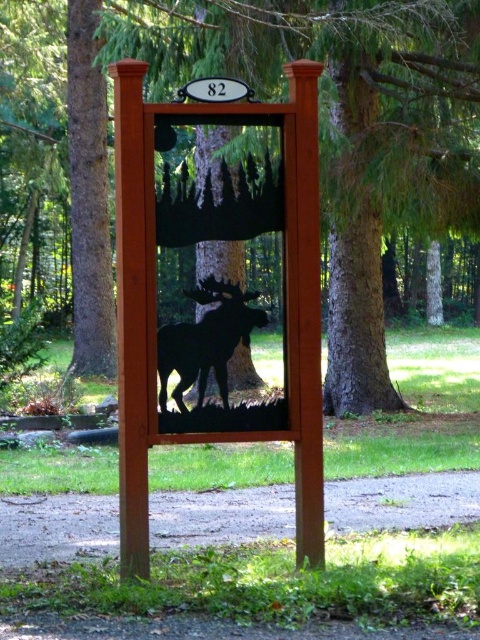
You are a hiker who just arrived at the signpost and wants to take a photo of the matte wood sign at center and the black matte moose at center. Since you want both objects to be clearly visible in your photo, which one should you focus on first?

The matte wood sign at center is in front of the black matte moose at center, so you should focus on the matte wood sign at center first to ensure both are in clear focus.

In the scene shown: You are a hiker trying to read the address on the matte wood sign at center and the black matte moose at center. Which object takes up more space in the image?

The matte wood sign at center is bigger than the black matte moose at center, so it takes up more space in the image.

You are a painter standing at the edge of the scene. You want to paint the brown wood tree at center and the matte wood sign at center. Based on their widths, which object should you focus on first if you want to capture the wider one?

The brown wood tree at center might be wider than matte wood sign at center, so you should focus on the brown wood tree at center first to capture the wider object.